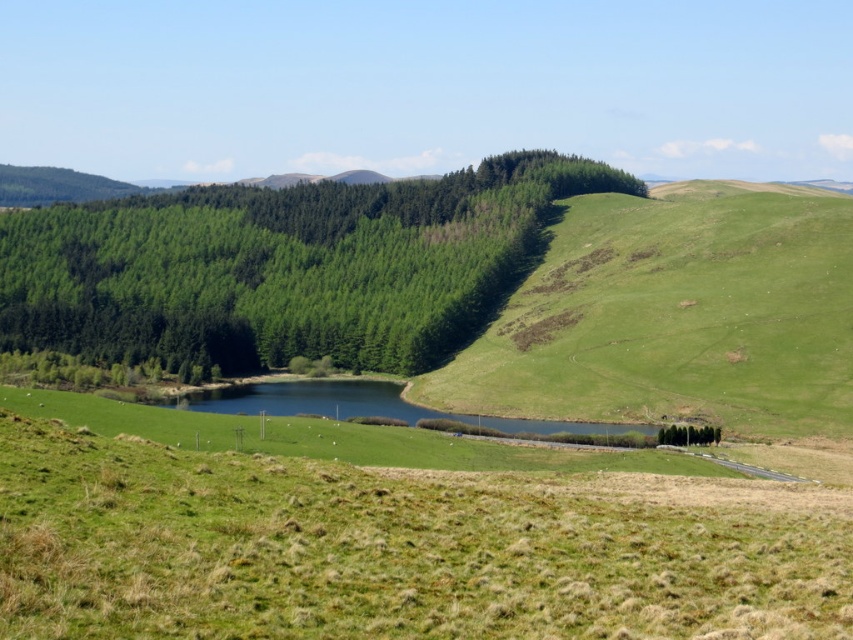
Question: Which point appears farthest from the camera in this image?

Choices:
 (A) (309, 504)
 (B) (688, 257)
 (C) (357, 196)

Answer: (C)

Question: Can you confirm if green grass at center is positioned to the right of green textured forest at center?

Choices:
 (A) no
 (B) yes

Answer: (B)

Question: Which object is the closest to the green grass at center?

Choices:
 (A) green textured forest at center
 (B) green grassy hillside at center

Answer: (B)

Question: Is green grass at center positioned in front of green grassy hillside at center?

Choices:
 (A) yes
 (B) no

Answer: (A)

Question: Based on their relative distances, which object is farther from the green textured forest at center?

Choices:
 (A) green grass at center
 (B) green grassy hillside at center

Answer: (A)

Question: Can you confirm if green grass at center is positioned to the left of green textured forest at center?

Choices:
 (A) no
 (B) yes

Answer: (A)